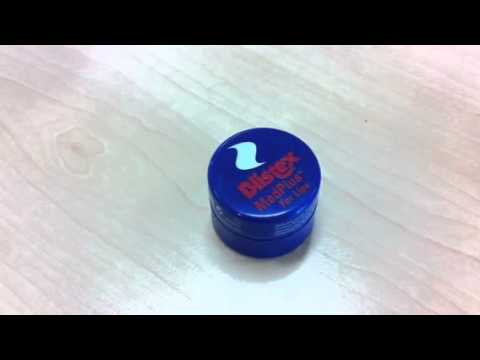
Identify the location of blue jar with twist cap. (218, 192).